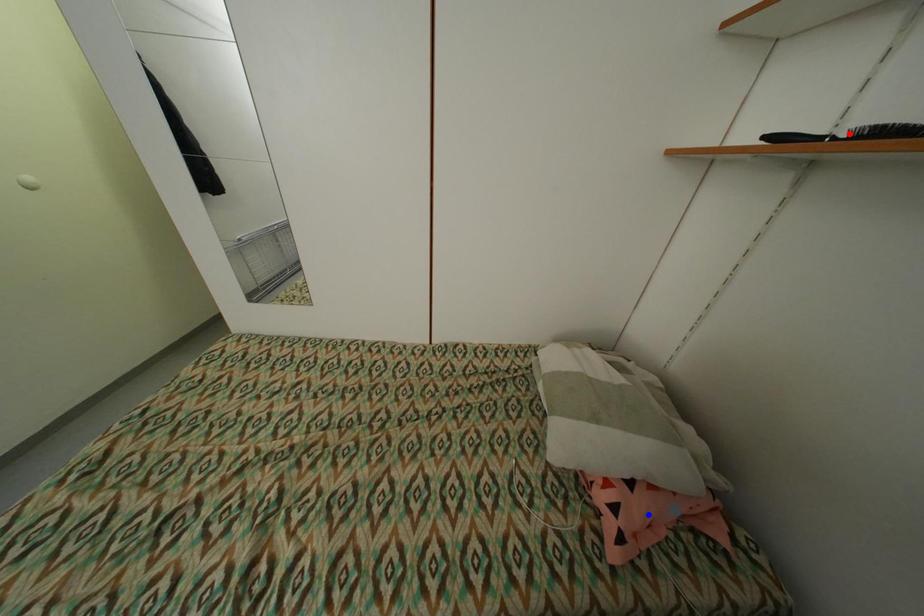
Question: Which of the two points in the image is closer to the camera?

Choices:
 (A) Blue point is closer.
 (B) Red point is closer.

Answer: (B)